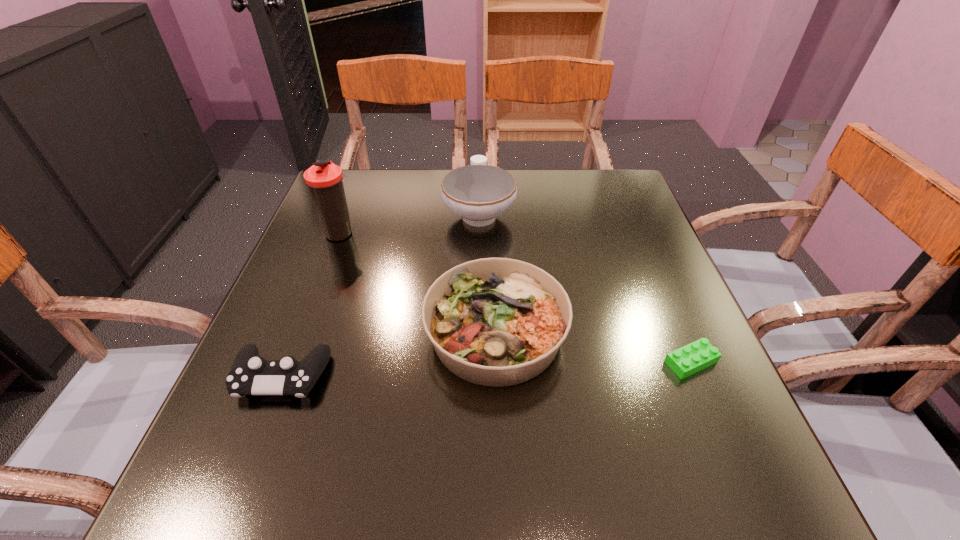
At what (x,y) coordinates should I click in order to perform the action: click on vacant region that satisfies the following two spatial constraints: 1. on the front side of the rightmost object; 2. on the left side of the salad plate. Please return your answer as a coordinate pair (x, y). Looking at the image, I should click on (496, 362).